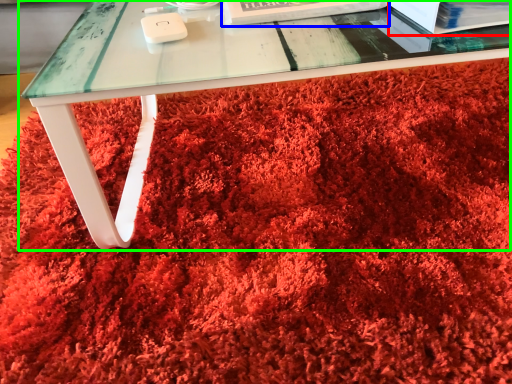
Question: Which object is the farthest from paperback book (highlighted by a red box)? Choose among these: paperback book (highlighted by a blue box) or table (highlighted by a green box).

Choices:
 (A) paperback book
 (B) table

Answer: (B)